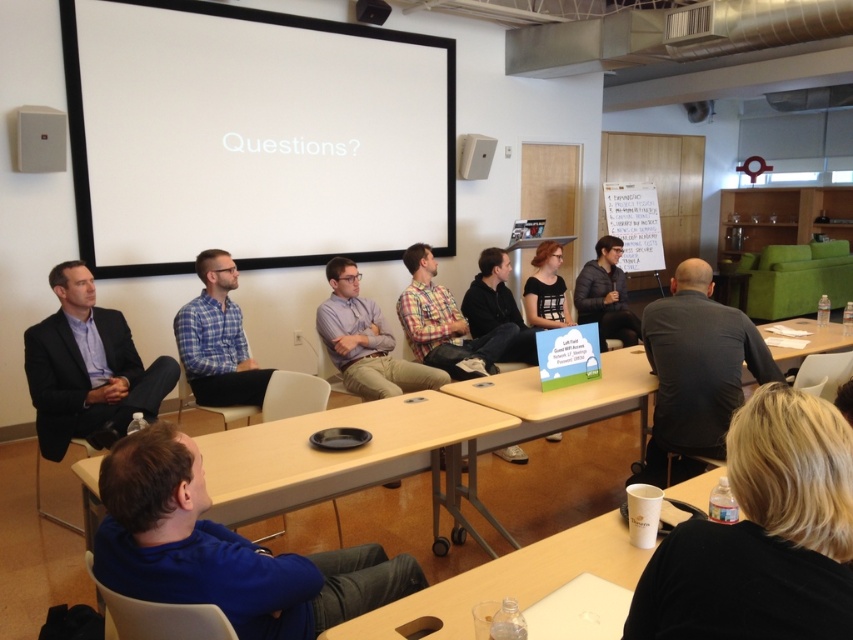
Which is more to the right, light brown wooden table at center or purple shirt at center?

light brown wooden table at center

Is light brown wooden table at center positioned behind purple shirt at center?

No, it is not.

What do you see at coordinates (352, 460) in the screenshot? I see `light brown wooden table at center` at bounding box center [352, 460].

At what (x,y) coordinates should I click in order to perform the action: click on light brown wooden table at center. Please return your answer as a coordinate pair (x, y). Looking at the image, I should click on (352, 460).

Is point (693, 413) farther from camera compared to point (445, 294)?

That is False.

Can you confirm if dark gray shirt at center is positioned to the right of plaid shirt at center?

Indeed, dark gray shirt at center is positioned on the right side of plaid shirt at center.

Is point (720, 337) positioned in front of point (410, 314)?

Yes, point (720, 337) is in front of point (410, 314).

Where is `dark gray shirt at center`? This screenshot has width=853, height=640. dark gray shirt at center is located at coordinates (695, 371).

Describe the element at coordinates (223, 548) in the screenshot. This screenshot has height=640, width=853. I see `blue fabric shirt at lower left` at that location.

Does blue fabric shirt at lower left appear under white plastic projector at upper center?

Correct, blue fabric shirt at lower left is located below white plastic projector at upper center.

You are a GUI agent. You are given a task and a screenshot of the screen. Output one action in this format:
    pyautogui.click(x=<x>, y=<y>)
    Task: Click on the blue fabric shirt at lower left
    This screenshot has width=853, height=640.
    Given the screenshot: What is the action you would take?
    pyautogui.click(x=223, y=548)

Identify the location of blue fabric shirt at lower left. coord(223,548).